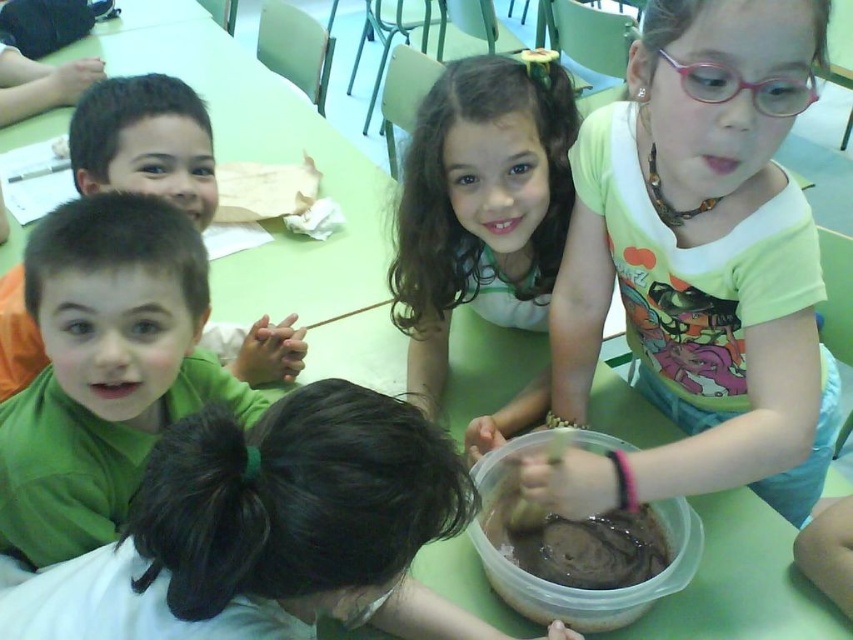
Question: Is green matte shirt at upper left smaller than brown matte plastic bowl at lower center?

Choices:
 (A) yes
 (B) no

Answer: (B)

Question: Considering the relative positions of light green t-shirt at upper right and brown matte plastic bowl at lower center in the image provided, where is light green t-shirt at upper right located with respect to brown matte plastic bowl at lower center?

Choices:
 (A) below
 (B) above

Answer: (B)

Question: Among these points, which one is farthest from the camera?

Choices:
 (A) click(x=764, y=244)
 (B) click(x=531, y=436)
 (C) click(x=206, y=134)

Answer: (C)

Question: Which of the following is the closest to the observer?

Choices:
 (A) (659, 394)
 (B) (674, 577)
 (C) (374, 596)

Answer: (C)

Question: Which point is closer to the camera?

Choices:
 (A) brown matte plastic bowl at lower center
 (B) dark brown hair at center
 (C) curly brown hair at upper center

Answer: (B)

Question: Can you confirm if dark brown hair at center is positioned below green matte shirt at left?

Choices:
 (A) yes
 (B) no

Answer: (A)